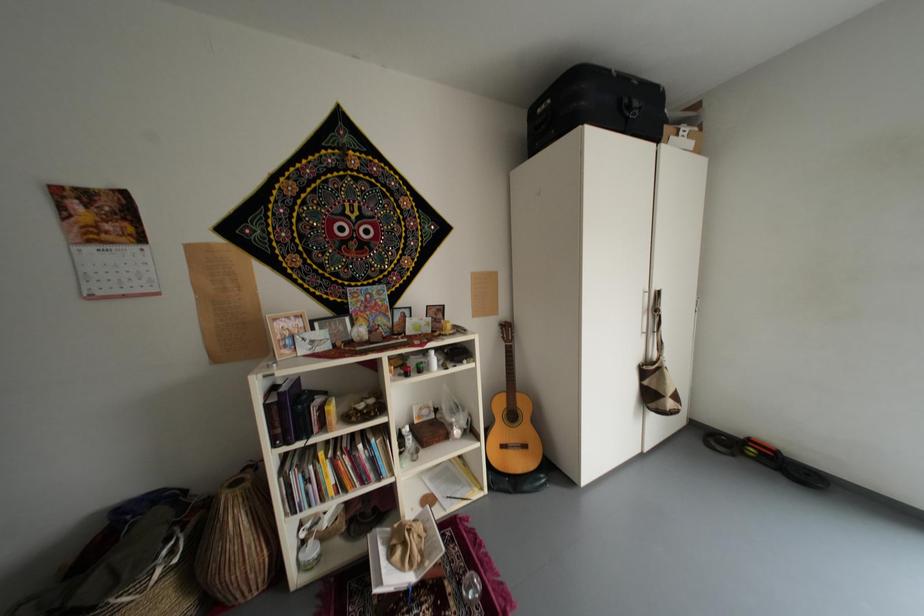
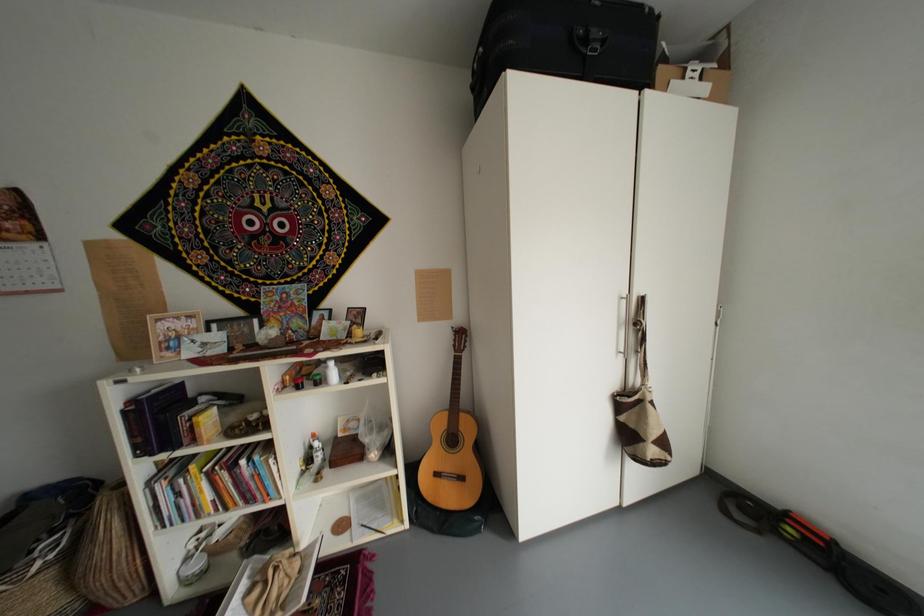
Question: The camera is either moving clockwise (left) or counter-clockwise (right) around the object. The first image is from the beginning of the video and the second image is from the end. Is the camera moving left or right when shooting the video?

Choices:
 (A) Left
 (B) Right

Answer: (B)